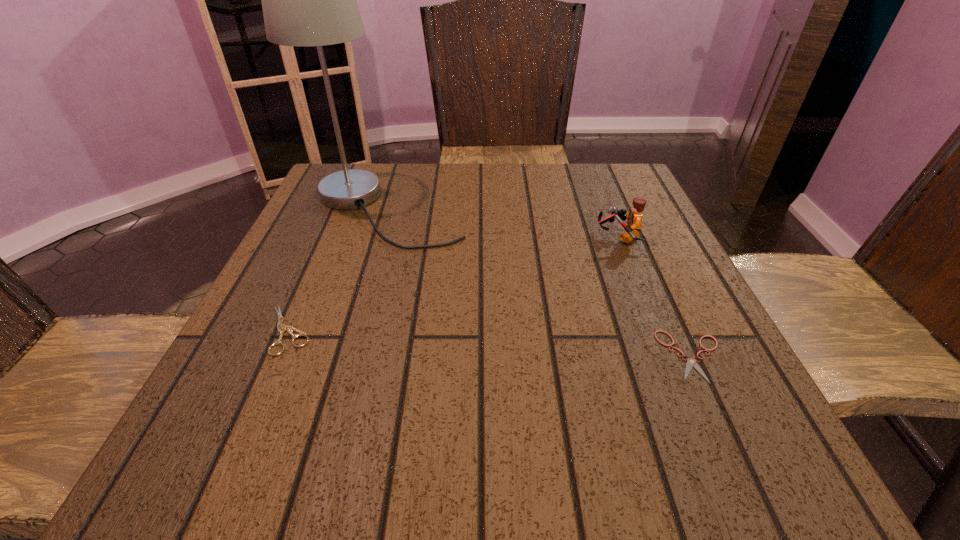
At what (x,y) coordinates should I click in order to perform the action: click on vacant area between the third shortest object and the taller shears. Please return your answer as a coordinate pair (x, y). This screenshot has height=540, width=960. Looking at the image, I should click on (453, 284).

Where is `free spot between the Lego and the second shortest object`? free spot between the Lego and the second shortest object is located at coordinates (453, 284).

Where is `vacant area that lies between the Lego and the left shears`? The width and height of the screenshot is (960, 540). vacant area that lies between the Lego and the left shears is located at coordinates (453, 284).

I want to click on free spot between the tallest object and the taller shears, so click(x=337, y=269).

Identify the location of vacant area that lies between the third shortest object and the table lamp. The image size is (960, 540). (502, 223).

The width and height of the screenshot is (960, 540). I want to click on object that can be found as the third closest to the tallest object, so click(x=691, y=362).

Locate which object ranks in proximity to the shorter shears. Please provide its 2D coordinates. Your answer should be formatted as a tuple, i.e. [(x, y)], where the tuple contains the x and y coordinates of a point satisfying the conditions above.

[(634, 218)]

Identify the location of free space that satisfies the following two spatial constraints: 1. holding a crossbow in the hands of the Lego; 2. on the left side of the shortest object. The image size is (960, 540). (664, 356).

The width and height of the screenshot is (960, 540). I want to click on free space that satisfies the following two spatial constraints: 1. holding a crossbow in the hands of the Lego; 2. on the right side of the right shears, so click(664, 356).

Where is `free region that satisfies the following two spatial constraints: 1. holding a crossbow in the hands of the second tallest object; 2. on the back side of the shortest object`? The width and height of the screenshot is (960, 540). free region that satisfies the following two spatial constraints: 1. holding a crossbow in the hands of the second tallest object; 2. on the back side of the shortest object is located at coordinates (664, 356).